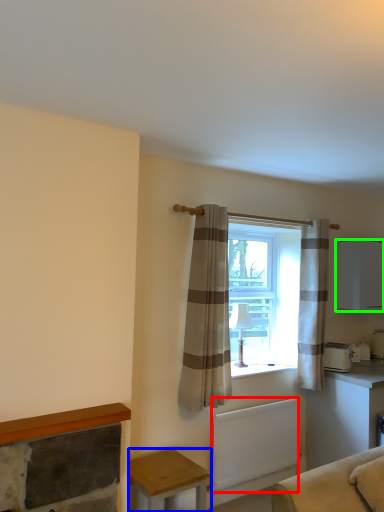
Question: Which object is positioned closest to radiator (highlighted by a red box)? Select from table (highlighted by a blue box) and cabinetry (highlighted by a green box).

Choices:
 (A) table
 (B) cabinetry

Answer: (A)